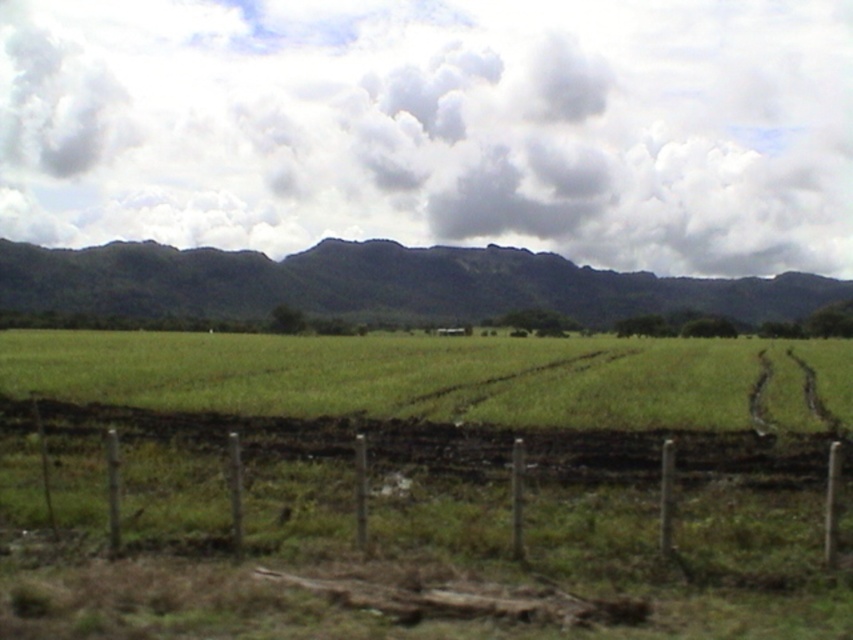
Question: Considering the relative positions of green grass at center and green leafy mountain at center in the image provided, where is green grass at center located with respect to green leafy mountain at center?

Choices:
 (A) right
 (B) left

Answer: (A)

Question: Does brown wire fence at lower center have a lesser width compared to green leafy mountain at center?

Choices:
 (A) yes
 (B) no

Answer: (A)

Question: Which point is closer to the camera?

Choices:
 (A) green leafy mountain at center
 (B) green grass at center
 (C) brown wire fence at lower center

Answer: (C)

Question: Which point is closer to the camera taking this photo?

Choices:
 (A) (233, 401)
 (B) (840, 525)
 (C) (22, 248)

Answer: (B)

Question: Which point is farther from the camera taking this photo?

Choices:
 (A) (213, 310)
 (B) (152, 516)

Answer: (A)

Question: Is brown wire fence at lower center positioned before green leafy mountain at center?

Choices:
 (A) yes
 (B) no

Answer: (A)